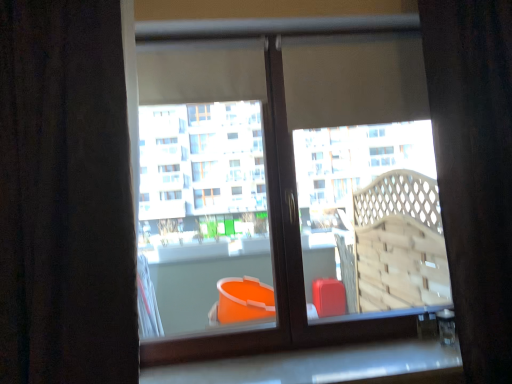
Question: Is white marble window sill at lower center at the right side of brown textured curtain at left, placed as the first curtain when sorted from left to right?

Choices:
 (A) yes
 (B) no

Answer: (A)

Question: Can you confirm if white marble window sill at lower center is shorter than brown textured curtain at left, placed as the first curtain when sorted from left to right?

Choices:
 (A) no
 (B) yes

Answer: (B)

Question: From the image's perspective, is white marble window sill at lower center below brown textured curtain at left, arranged as the 2th curtain when viewed from the right?

Choices:
 (A) yes
 (B) no

Answer: (A)

Question: Is white marble window sill at lower center to the left of brown textured curtain at left, arranged as the 2th curtain when viewed from the right, from the viewer's perspective?

Choices:
 (A) no
 (B) yes

Answer: (A)

Question: From a real-world perspective, is white marble window sill at lower center below brown textured curtain at left, placed as the first curtain when sorted from left to right?

Choices:
 (A) no
 (B) yes

Answer: (B)

Question: Based on their sizes in the image, would you say velvet dark brown curtain at right, which is counted as the first curtain, starting from the right, is bigger or smaller than white marble window sill at lower center?

Choices:
 (A) small
 (B) big

Answer: (B)

Question: Based on their positions, is velvet dark brown curtain at right, arranged as the second curtain when viewed from the left, located to the left or right of white marble window sill at lower center?

Choices:
 (A) right
 (B) left

Answer: (A)

Question: From a real-world perspective, is velvet dark brown curtain at right, which is counted as the first curtain, starting from the right, physically located above or below white marble window sill at lower center?

Choices:
 (A) below
 (B) above

Answer: (B)

Question: Considering the positions of velvet dark brown curtain at right, which is counted as the first curtain, starting from the right, and white marble window sill at lower center in the image, is velvet dark brown curtain at right, which is counted as the first curtain, starting from the right, taller or shorter than white marble window sill at lower center?

Choices:
 (A) tall
 (B) short

Answer: (A)

Question: Considering the positions of brown textured curtain at left, placed as the first curtain when sorted from left to right, and velvet dark brown curtain at right, which is counted as the first curtain, starting from the right, in the image, is brown textured curtain at left, placed as the first curtain when sorted from left to right, wider or thinner than velvet dark brown curtain at right, which is counted as the first curtain, starting from the right,?

Choices:
 (A) wide
 (B) thin

Answer: (B)

Question: Considering the relative positions of brown textured curtain at left, arranged as the 2th curtain when viewed from the right, and velvet dark brown curtain at right, which is counted as the first curtain, starting from the right, in the image provided, is brown textured curtain at left, arranged as the 2th curtain when viewed from the right, to the left or to the right of velvet dark brown curtain at right, which is counted as the first curtain, starting from the right,?

Choices:
 (A) right
 (B) left

Answer: (B)

Question: Is brown textured curtain at left, placed as the first curtain when sorted from left to right, taller or shorter than velvet dark brown curtain at right, arranged as the second curtain when viewed from the left?

Choices:
 (A) short
 (B) tall

Answer: (A)

Question: Considering the positions of brown textured curtain at left, placed as the first curtain when sorted from left to right, and velvet dark brown curtain at right, which is counted as the first curtain, starting from the right, in the image, is brown textured curtain at left, placed as the first curtain when sorted from left to right, bigger or smaller than velvet dark brown curtain at right, which is counted as the first curtain, starting from the right,?

Choices:
 (A) small
 (B) big

Answer: (A)

Question: In terms of size, does white marble window sill at lower center appear bigger or smaller than velvet dark brown curtain at right, arranged as the second curtain when viewed from the left?

Choices:
 (A) small
 (B) big

Answer: (A)

Question: Based on their positions, is white marble window sill at lower center located to the left or right of velvet dark brown curtain at right, which is counted as the first curtain, starting from the right?

Choices:
 (A) right
 (B) left

Answer: (B)